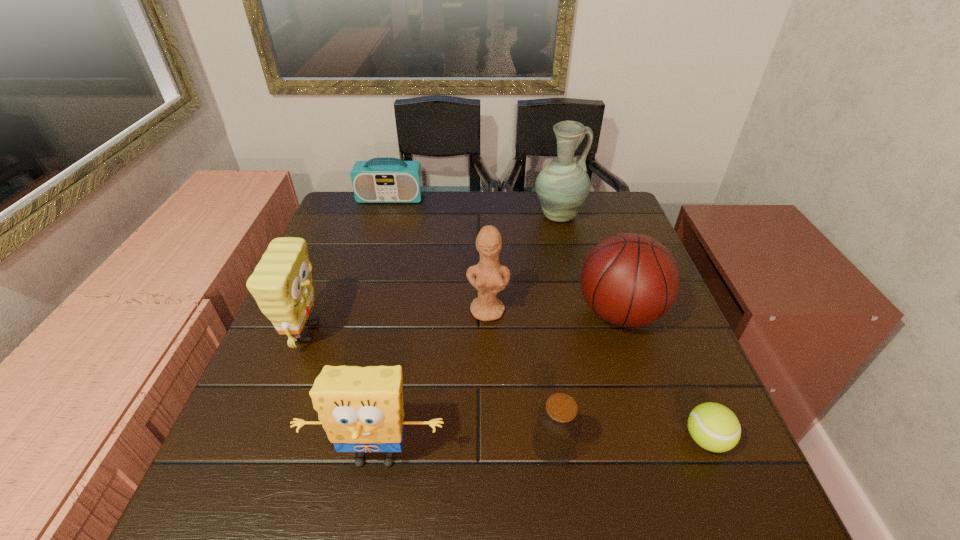
Identify the location of free space located 0.080m on the front-facing side of the fifth object from right to left. (489, 350).

This screenshot has height=540, width=960. Find the location of `vacant space located on the face of the left sponge`. vacant space located on the face of the left sponge is located at coordinates (371, 333).

I want to click on free space located 0.320m on the front of the basketball, so click(680, 494).

Locate an element on the screen. The width and height of the screenshot is (960, 540). free space located on the face of the nearer sponge is located at coordinates (363, 524).

In order to click on vacant position located 0.080m on the left of the jar in this screenshot , I will do `click(489, 445)`.

Where is `vacant space located 0.060m on the back of the shortest object`? The height and width of the screenshot is (540, 960). vacant space located 0.060m on the back of the shortest object is located at coordinates (686, 392).

I want to click on radio receiver that is at the far edge, so click(x=380, y=180).

Image resolution: width=960 pixels, height=540 pixels. I want to click on pitcher at the far edge, so click(562, 186).

The width and height of the screenshot is (960, 540). Find the location of `object that is positioned at the near edge`. object that is positioned at the near edge is located at coordinates (361, 409).

Image resolution: width=960 pixels, height=540 pixels. Identify the location of radio receiver present at the left edge. pos(380,180).